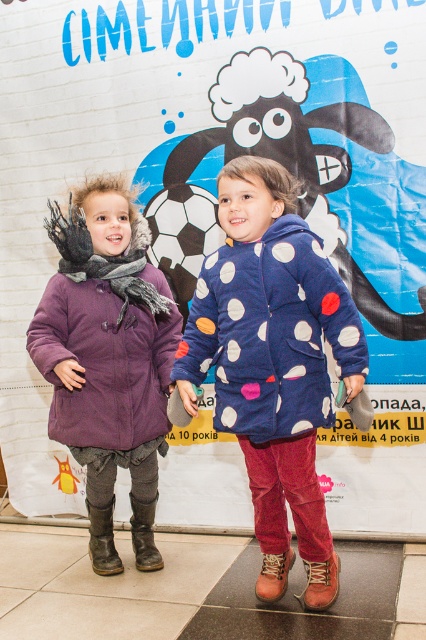
Does blue fleece jacket at center appear on the left side of brown suede boot at lower center?

Indeed, blue fleece jacket at center is positioned on the left side of brown suede boot at lower center.

What are the coordinates of `blue fleece jacket at center` in the screenshot? It's located at (270, 332).

Where is `blue fleece jacket at center`? The width and height of the screenshot is (426, 640). blue fleece jacket at center is located at coordinates (270, 332).

From the picture: Can you confirm if brown leather boot at lower left is bigger than brown suede boot at lower center?

Yes.

Image resolution: width=426 pixels, height=640 pixels. I want to click on brown leather boot at lower left, so pos(103,540).

What do you see at coordinates (106, 349) in the screenshot? I see `purple quilted coat at left` at bounding box center [106, 349].

Is purple quilted coat at left further to camera compared to purple corduroy jacket at left?

No, it is in front of purple corduroy jacket at left.

Image resolution: width=426 pixels, height=640 pixels. I want to click on purple quilted coat at left, so click(106, 349).

Identify the location of purple quilted coat at left. (106, 349).